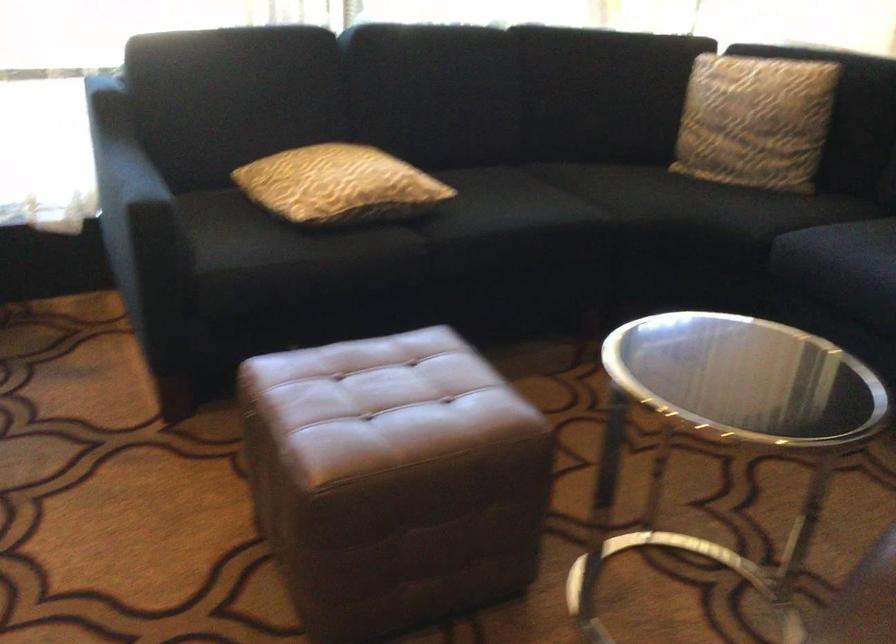
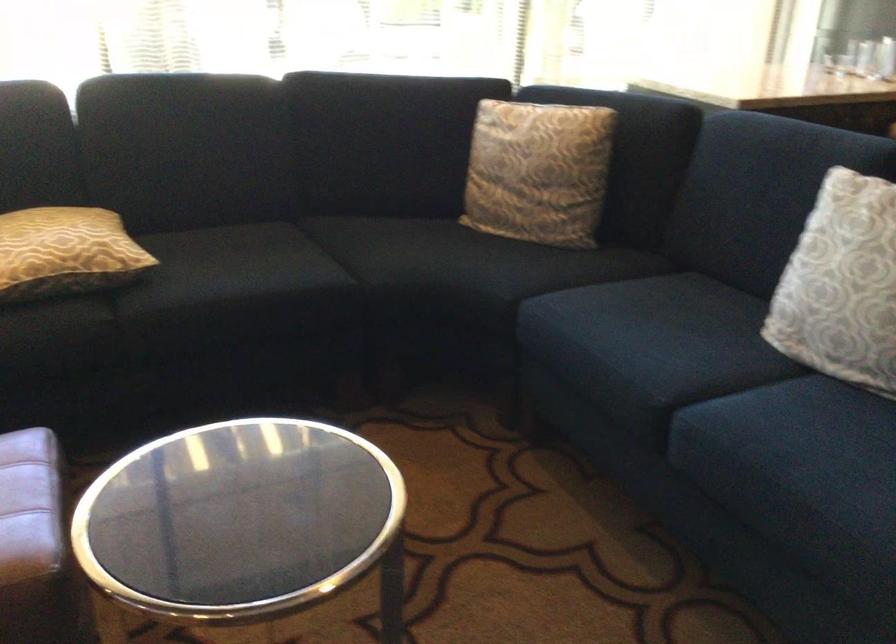
Question: What movement of the cameraman would produce the second image?

Choices:
 (A) Left
 (B) Right
 (C) Forward
 (D) Backward

Answer: (B)